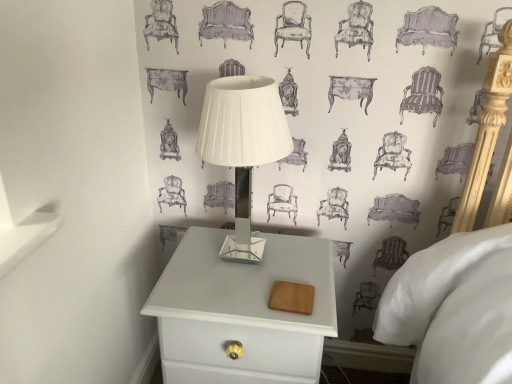
Locate an element on the screen. free spot below white glossy table lamp at center (from a real-world perspective) is located at coordinates (243, 255).